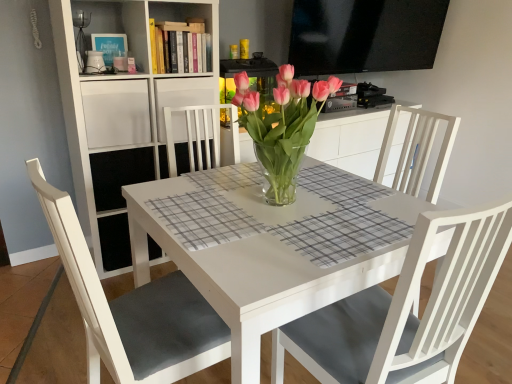
Question: Is white wood shelf at upper center, placed as the 1th shelf when sorted from top to bottom, next to white glossy table at center and touching it?

Choices:
 (A) yes
 (B) no

Answer: (B)

Question: Is white wood shelf at upper center, placed as the 1th shelf when sorted from top to bottom, positioned behind white glossy table at center?

Choices:
 (A) no
 (B) yes

Answer: (B)

Question: Can you confirm if white wood shelf at upper center, the 3th shelf positioned from the bottom, is positioned to the left of white glossy table at center?

Choices:
 (A) yes
 (B) no

Answer: (A)

Question: Does white wood shelf at upper center, placed as the 1th shelf when sorted from top to bottom, have a smaller size compared to white glossy table at center?

Choices:
 (A) yes
 (B) no

Answer: (A)

Question: In terms of height, does white matte bookshelf at upper left, which is counted as the 3th shelf, starting from the top, look taller or shorter compared to pink glass vase at center?

Choices:
 (A) tall
 (B) short

Answer: (A)

Question: In the image, is white matte bookshelf at upper left, which is the 1th shelf in bottom-to-top order, positioned in front of or behind pink glass vase at center?

Choices:
 (A) front
 (B) behind

Answer: (B)

Question: From the image's perspective, is white matte bookshelf at upper left, which is the 1th shelf in bottom-to-top order, positioned above or below pink glass vase at center?

Choices:
 (A) below
 (B) above

Answer: (B)

Question: Considering the positions of point (184, 72) and point (332, 81), is point (184, 72) closer or farther from the camera than point (332, 81)?

Choices:
 (A) closer
 (B) farther

Answer: (B)

Question: Is white matte chair at lower left in front of or behind white wood shelf at upper center, the 3th shelf positioned from the bottom, in the image?

Choices:
 (A) behind
 (B) front

Answer: (B)

Question: Considering the positions of white matte chair at lower left and white wood shelf at upper center, the 3th shelf positioned from the bottom, in the image, is white matte chair at lower left taller or shorter than white wood shelf at upper center, the 3th shelf positioned from the bottom,?

Choices:
 (A) short
 (B) tall

Answer: (B)

Question: Is white matte chair at lower left inside the boundaries of white wood shelf at upper center, placed as the 1th shelf when sorted from top to bottom, or outside?

Choices:
 (A) inside
 (B) outside

Answer: (B)

Question: Does point (188, 334) appear closer or farther from the camera than point (159, 81)?

Choices:
 (A) farther
 (B) closer

Answer: (B)

Question: Is white matte shelf at upper left, which appears as the 2th shelf when ordered from the bottom, situated inside pink glass vase at center or outside?

Choices:
 (A) inside
 (B) outside

Answer: (B)

Question: Is point (117, 89) closer or farther from the camera than point (287, 167)?

Choices:
 (A) closer
 (B) farther

Answer: (B)